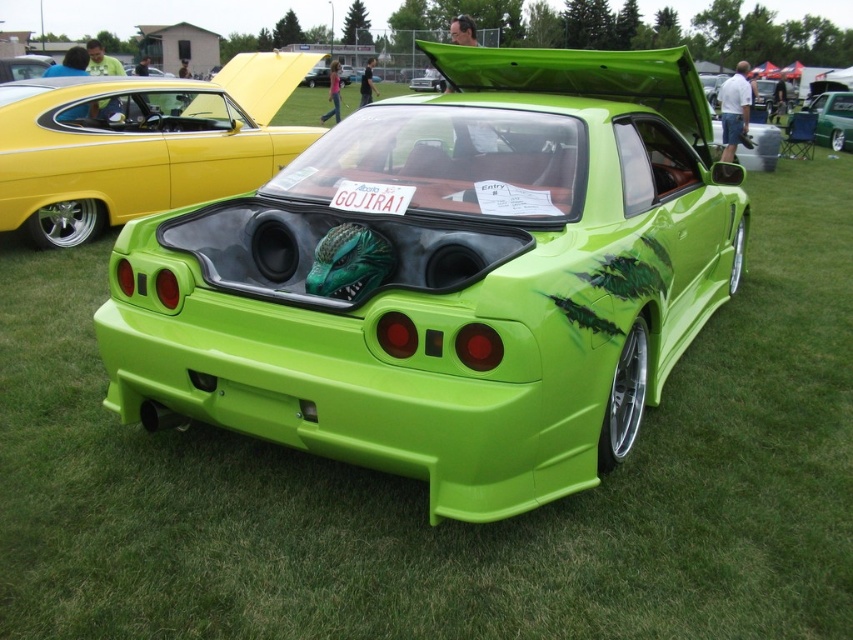
How much distance is there between green matte license plate at center and metallic green car at upper right?

green matte license plate at center is 21.21 meters from metallic green car at upper right.

From the picture: Between green matte license plate at center and metallic green car at upper right, which one is positioned lower?

Positioned lower is green matte license plate at center.

Find the location of a particular element. Image resolution: width=853 pixels, height=640 pixels. green matte license plate at center is located at coordinates (372, 196).

Where is `green matte license plate at center`? green matte license plate at center is located at coordinates (372, 196).

Between green matte sports car at center and green matte license plate at center, which one has more height?

green matte sports car at center is taller.

Which is more to the right, green matte sports car at center or green matte license plate at center?

green matte license plate at center

Does point (96, 177) come farther from viewer compared to point (357, 208)?

Yes.

This screenshot has height=640, width=853. In order to click on green matte sports car at center in this screenshot , I will do `click(140, 145)`.

This screenshot has width=853, height=640. What are the coordinates of `green matte sports car at center` in the screenshot? It's located at (140, 145).

Is point (186, 134) less distant than point (850, 115)?

Yes, point (186, 134) is closer to viewer.

Who is more forward, (91,134) or (813,108)?

Point (91,134) is more forward.

Locate an element on the screen. This screenshot has width=853, height=640. green matte sports car at center is located at coordinates (140, 145).